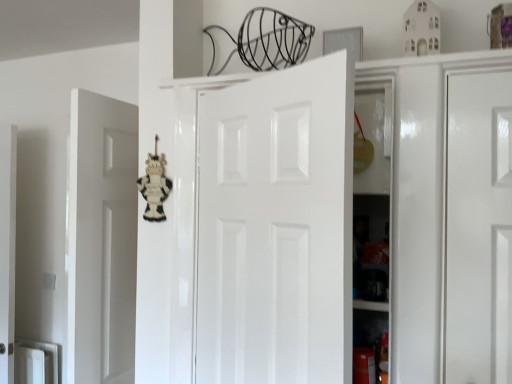
Describe the element at coordinates (155, 186) in the screenshot. The image size is (512, 384). I see `wooden cow at center` at that location.

The height and width of the screenshot is (384, 512). I want to click on wooden cow at center, so click(x=155, y=186).

In order to face white glossy door at center, should I rotate leftwards or rightwards?

You should look right and rotate roughly 0.562 degrees.

Locate an element on the screen. white glossy door at center is located at coordinates (276, 227).

What do you see at coordinates (276, 227) in the screenshot? I see `white glossy door at center` at bounding box center [276, 227].

Identify the location of wooden cow at center. This screenshot has width=512, height=384. (155, 186).

Which object is positioned more to the left, white glossy door at center or wooden cow at center?

wooden cow at center.

Is the position of white glossy door at center more distant than that of wooden cow at center?

No, it is not.

Is point (308, 209) closer to camera compared to point (151, 163)?

Yes.

From the image's perspective, would you say white glossy door at center is shown under wooden cow at center?

Yes, from the image's perspective, white glossy door at center is below wooden cow at center.

From a real-world perspective, which is physically above, white glossy door at center or wooden cow at center?

From a 3D spatial view, wooden cow at center is above.

Looking at this image, considering the sizes of objects white glossy door at center and wooden cow at center in the image provided, who is wider, white glossy door at center or wooden cow at center?

With larger width is white glossy door at center.

Looking at this image, between white glossy door at center and wooden cow at center, which one has less height?

wooden cow at center is shorter.

In terms of size, does white glossy door at center appear bigger or smaller than wooden cow at center?

Considering their sizes, white glossy door at center takes up more space than wooden cow at center.

Does white glossy door at center contain wooden cow at center?

No, white glossy door at center does not contain wooden cow at center.

Are white glossy door at center and wooden cow at center located far from each other?

No, white glossy door at center is in close proximity to wooden cow at center.

Is white glossy door at center aimed at wooden cow at center?

No, white glossy door at center is not facing towards wooden cow at center.

What's the angular difference between white glossy door at center and wooden cow at center's facing directions?

The facing directions of white glossy door at center and wooden cow at center are 31.9 degrees apart.

Where is `toy on the left side of white glossy door at center`? toy on the left side of white glossy door at center is located at coordinates (155, 186).

Considering the positions of objects wooden cow at center and white glossy door at center in the image provided, who is more to the right, wooden cow at center or white glossy door at center?

Positioned to the right is white glossy door at center.

Is wooden cow at center positioned before white glossy door at center?

No, wooden cow at center is further to the viewer.

Which is further, (166,197) or (334,94)?

Point (166,197)

From the image's perspective, is wooden cow at center below white glossy door at center?

No.

From a real-world perspective, who is located higher, wooden cow at center or white glossy door at center?

From a 3D spatial view, wooden cow at center is above.

Can you confirm if wooden cow at center is wider than white glossy door at center?

No.

Looking at this image, from their relative heights in the image, would you say wooden cow at center is taller or shorter than white glossy door at center?

Considering their sizes, wooden cow at center has less height than white glossy door at center.

Can you confirm if wooden cow at center is bigger than white glossy door at center?

Actually, wooden cow at center might be smaller than white glossy door at center.

Is white glossy door at center located within wooden cow at center?

No, wooden cow at center does not contain white glossy door at center.

Is wooden cow at center in contact with white glossy door at center?

They are not placed beside each other.

Is wooden cow at center positioned with its back to white glossy door at center?

wooden cow at center is not turned away from white glossy door at center.

Can you tell me how much wooden cow at center and white glossy door at center differ in facing direction?

The angle between the facing direction of wooden cow at center and the facing direction of white glossy door at center is 31.9 degrees.

How distant is wooden cow at center from white glossy door at center?

wooden cow at center is 45.31 centimeters from white glossy door at center.

This screenshot has height=384, width=512. What are the coordinates of `door that is under the wooden cow at center (from a real-world perspective)` in the screenshot? It's located at (276, 227).

Identify the location of door on the right of the wooden cow at center. The image size is (512, 384). (276, 227).

I want to click on door located below the wooden cow at center (from the image's perspective), so click(276, 227).